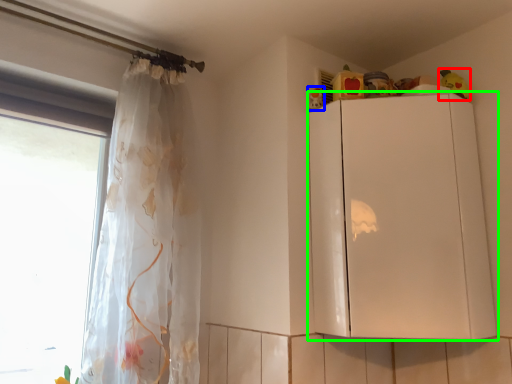
Question: Estimate the real-world distances between objects in this image. Which object is farther from toy (highlighted by a red box), toy (highlighted by a blue box) or cabinetry (highlighted by a green box)?

Choices:
 (A) toy
 (B) cabinetry

Answer: (B)